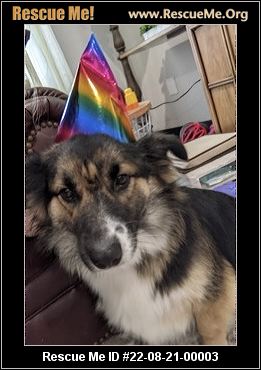
The image size is (261, 370). Find the location of `electic cord`. electic cord is located at coordinates (175, 97).